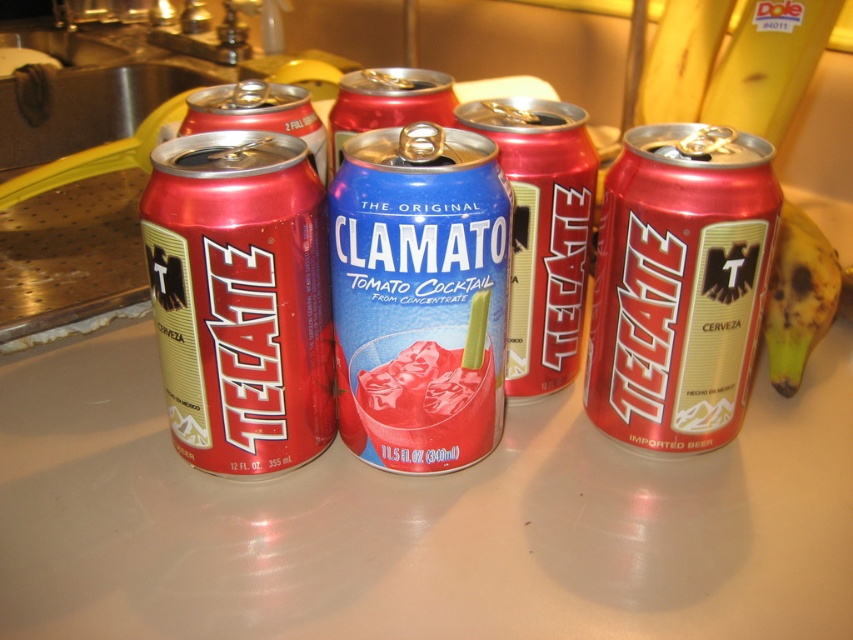
Question: Which object is positioned farthest from the yellow/golden skin at right?

Choices:
 (A) matte red can at left
 (B) matte red can at center

Answer: (A)

Question: Which object is closer to the camera taking this photo?

Choices:
 (A) yellow/golden skin at right
 (B) matte red can at center
 (C) matte red can at left

Answer: (C)

Question: Does matte red can at left lie in front of matte red can at center?

Choices:
 (A) yes
 (B) no

Answer: (A)

Question: Can you confirm if matte red can at center is smaller than yellow/golden skin at right?

Choices:
 (A) yes
 (B) no

Answer: (A)

Question: Based on their relative distances, which object is nearer to the yellow/golden skin at right?

Choices:
 (A) matte red can at left
 (B) matte red can at center

Answer: (B)

Question: Does matte red can at center have a greater width compared to yellow/golden skin at right?

Choices:
 (A) no
 (B) yes

Answer: (A)